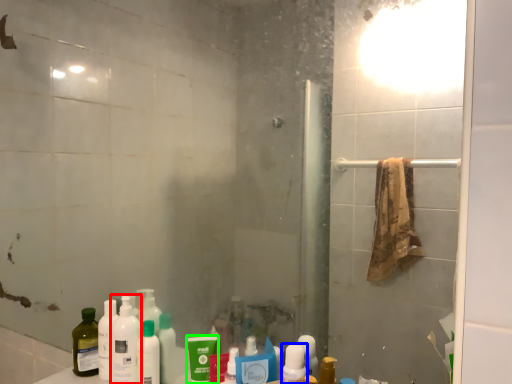
Question: Based on their relative distances, which object is farther from cleaning product (highlighted by a red box)? Choose from mouthwash (highlighted by a blue box) and mouthwash (highlighted by a green box).

Choices:
 (A) mouthwash
 (B) mouthwash

Answer: (A)